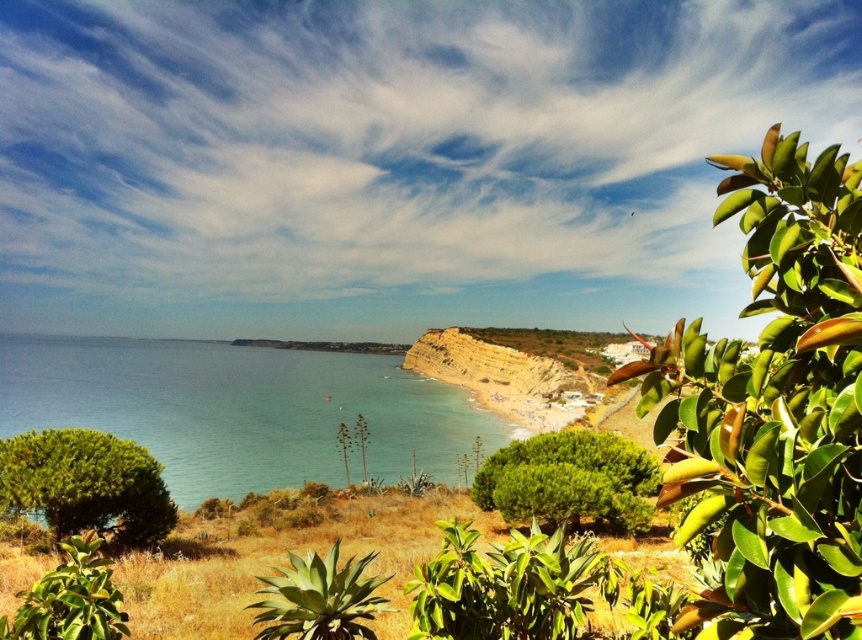
How distant is green leafy bush at lower left from green succulent at center?

The distance of green leafy bush at lower left from green succulent at center is 7.04 meters.

Identify the location of green leafy bush at lower left. (86, 484).

Is point (117, 502) closer to camera compared to point (305, 572)?

No, it is not.

The width and height of the screenshot is (862, 640). Identify the location of green leafy bush at lower left. 86,484.

The width and height of the screenshot is (862, 640). Describe the element at coordinates (773, 406) in the screenshot. I see `green glossy leaves at upper right` at that location.

Is green glossy leaves at upper right closer to camera compared to blue water at center?

Yes, green glossy leaves at upper right is in front of blue water at center.

Does point (721, 209) lie behind point (97, 378)?

No, (721, 209) is closer to viewer.

Locate an element on the screen. green glossy leaves at upper right is located at coordinates (773, 406).

Does green leafy bush at center have a lesser width compared to green succulent at center?

Indeed, green leafy bush at center has a lesser width compared to green succulent at center.

Which is in front, point (642, 522) or point (316, 576)?

Point (316, 576) is more forward.

Is point (635, 493) farther from viewer compared to point (334, 544)?

That is True.

Find the location of a particular element. This screenshot has height=640, width=862. green leafy bush at center is located at coordinates (569, 480).